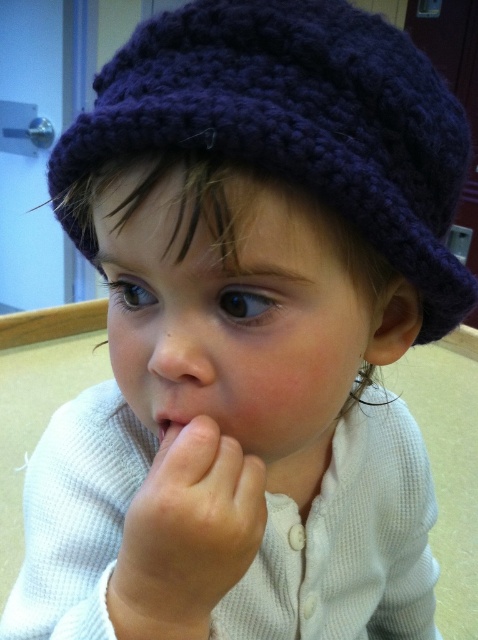
You are an interior designer planning to place a small decorative item at the point marked by coordinates point [290,125]. Based on the scene, what object is located at this position?

The point [290,125] marks the location of the dark blue knitted hat at upper center.

You are a healthcare professional observing a child in a clinic. You notice the smooth skin hand at center and the smooth flesh at center. Which of these two body parts is taller?

The smooth skin hand at center is taller than the smooth flesh at center.

Consider the image. You are a photographer trying to capture a closeup shot of the dark blue knitted hat at upper center. If your camera lens can focus on objects within 10 inches, will you be able to take the photo without moving closer?

The dark blue knitted hat at upper center is 8.64 inches away from the viewer, which is within the camera lens focus range of 10 inches. Therefore, you can take the photo without moving closer.